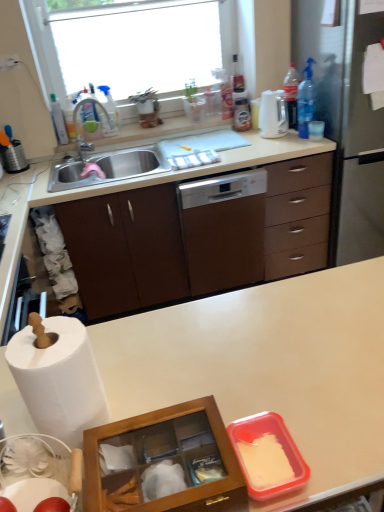
Identify the location of free spot behind wooden glass at center. This screenshot has height=512, width=384. (183, 376).